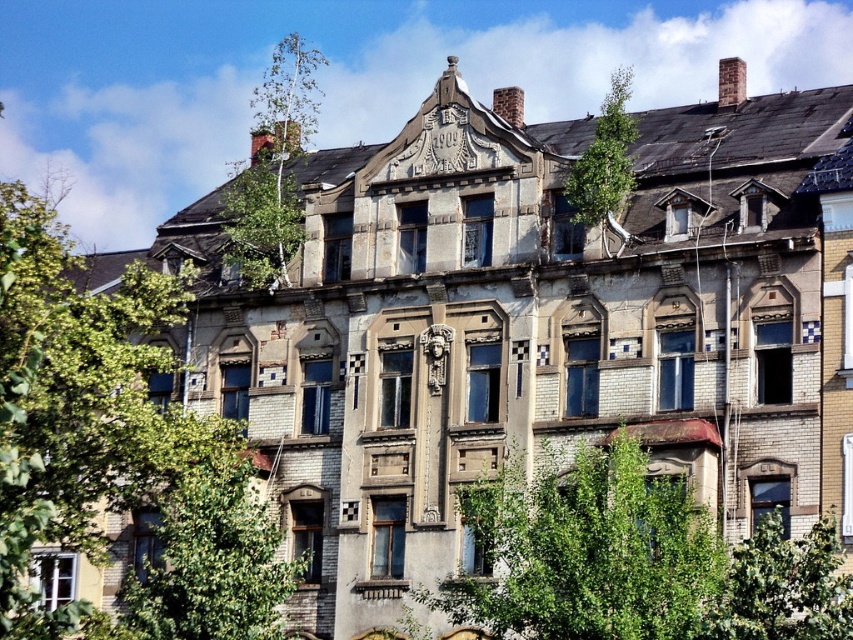
Question: Which point appears farthest from the camera in this image?

Choices:
 (A) (672, 579)
 (B) (88, 353)
 (C) (286, 177)

Answer: (C)

Question: Does green leafy tree at center come in front of green leafy tree at lower right?

Choices:
 (A) no
 (B) yes

Answer: (A)

Question: Which object appears farthest from the camera in this image?

Choices:
 (A) green leafy tree at upper left
 (B) green leafy tree at upper right
 (C) green leafy tree at center
 (D) green leafy tree at lower right

Answer: (B)

Question: Can you confirm if green leafy tree at center is bigger than green leafy tree at lower right?

Choices:
 (A) no
 (B) yes

Answer: (B)

Question: Which object is the farthest from the green leafy tree at center?

Choices:
 (A) green leafy tree at upper left
 (B) green leafy tree at upper center

Answer: (B)

Question: Is green leafy tree at center to the left of green leafy tree at lower right from the viewer's perspective?

Choices:
 (A) no
 (B) yes

Answer: (B)